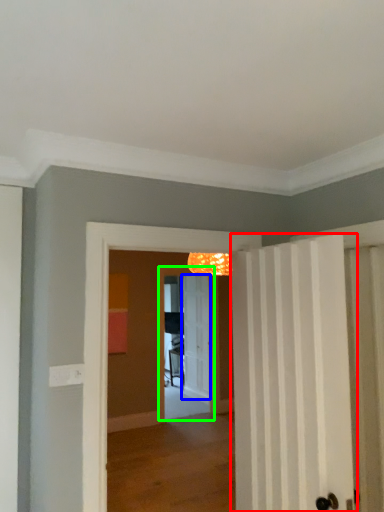
Question: Which object is positioned farthest from door (highlighted by a red box)? Select from door (highlighted by a blue box) and screen door (highlighted by a green box).

Choices:
 (A) door
 (B) screen door

Answer: (A)